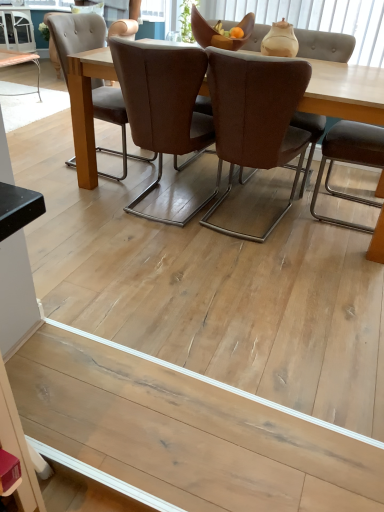
Locate an element on the screen. The height and width of the screenshot is (512, 384). vacant space situated on the left part of brown leather chair at center, positioned as the 3th chair in right-to-left order is located at coordinates (91, 197).